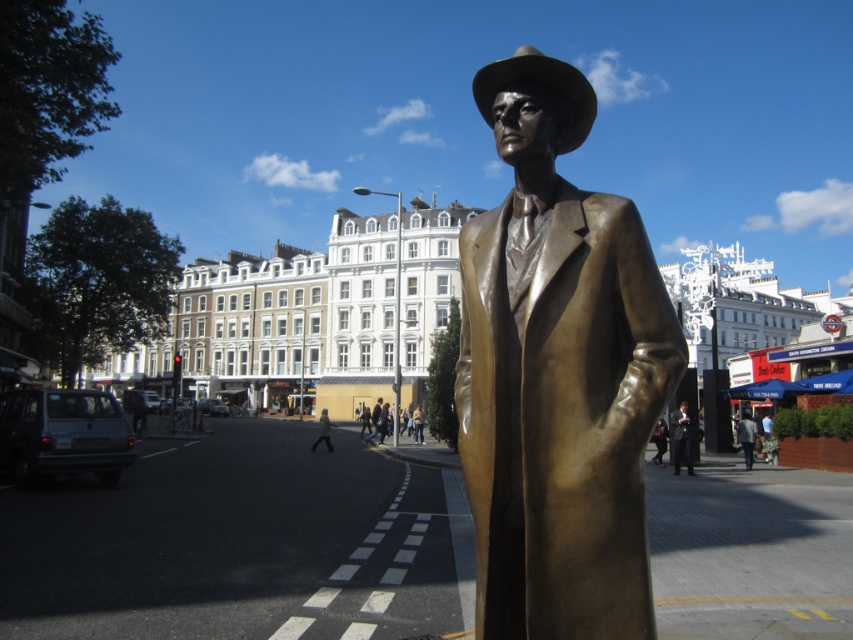
Question: Is the position of shiny bronze fedora at center less distant than that of light gray knit sweater at center?

Choices:
 (A) yes
 (B) no

Answer: (A)

Question: Does shiny bronze fedora at center appear under matte black coat at center?

Choices:
 (A) yes
 (B) no

Answer: (B)

Question: Which object is the farthest from the matte black coat at center?

Choices:
 (A) shiny bronze statue at center
 (B) dark gray suit at center

Answer: (A)

Question: Can you confirm if shiny bronze fedora at center is positioned to the right of dark gray suit at center?

Choices:
 (A) no
 (B) yes

Answer: (A)

Question: Which of these objects is positioned farthest from the matte black coat at center?

Choices:
 (A) light gray knit sweater at center
 (B) dark gray suit at center
 (C) shiny bronze statue at center

Answer: (C)

Question: Which object is closer to the camera taking this photo?

Choices:
 (A) dark gray suit at center
 (B) shiny bronze fedora at center
 (C) matte black coat at center

Answer: (B)